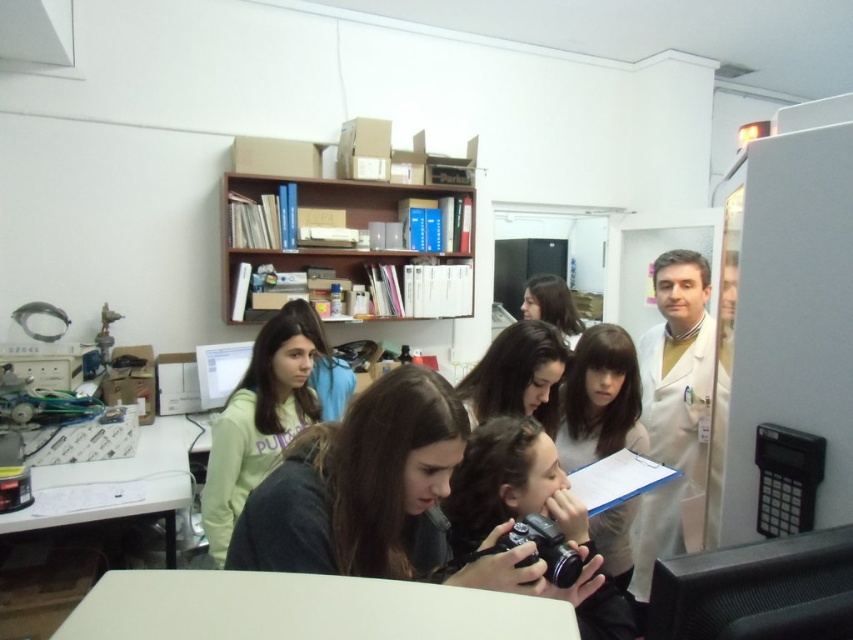
You are a tailor measuring clothes for two people in the scene. The first person is wearing a white lab coat at right, and the second is wearing a smooth beige shirt at center. Which garment has a larger width measurement?

The white lab coat at right has a larger width measurement than the smooth beige shirt at center because its width surpasses the shirt.

You are organizing a small workshop in the laboratory and need to place a 1.2 meter wide equipment on the white matte table at lower center. Considering the light green sweatshirt at center is currently occupying space on the table, will the equipment fit on the table?

The white matte table at lower center is wider than the light green sweatshirt at center. However, the equipment is 1.2 meters wide. Without knowing the exact dimensions of the table, it is impossible to determine if the equipment will fit. Please measure the table first.

You are a researcher who needs to hang a large poster on the wall. The poster is as wide as the white lab coat at right. Can you hang it on the wooden bookshelf at upper center without it extending beyond the shelf?

The wooden bookshelf at upper center might be wider than white lab coat at right, so there is a possibility that the poster will fit. However, since the exact width comparison is uncertain, it would be safer to measure the poster and the shelf before hanging it.